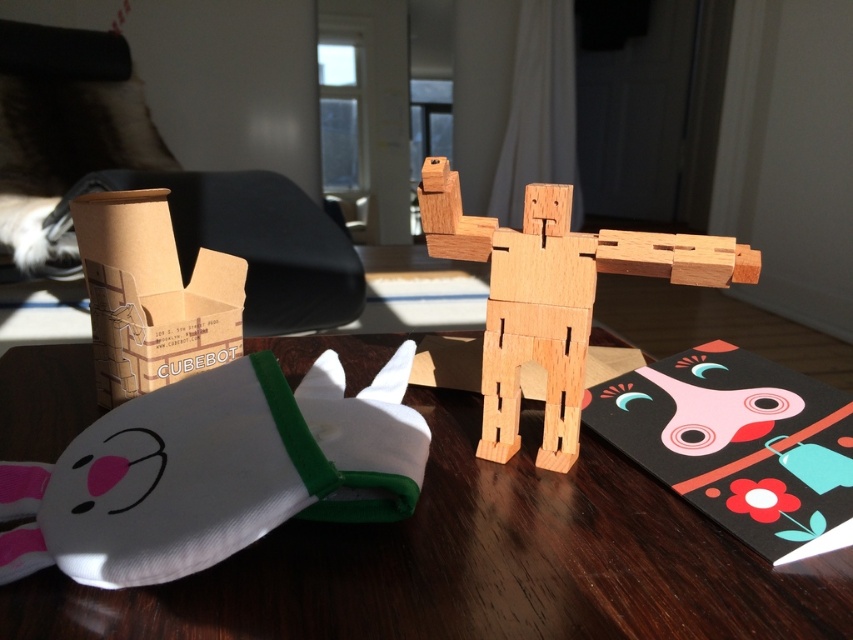
You are looking at the wooden block robot toy and the plush rabbit toy in the image. Which of the two points, point (78,355) or point (325,394), is closer to you?

Point (78,355) is closer to you than point (325,394).

You are looking at the wooden block robot toy and the plush rabbit toy on the table. There are two points marked on the table surface. The first point is at coordinates point (x=833, y=627) and the second is at point (x=561, y=305). From your perspective, which point is closer to you?

Point (x=833, y=627) is in front of point (x=561, y=305), so it is closer to you.